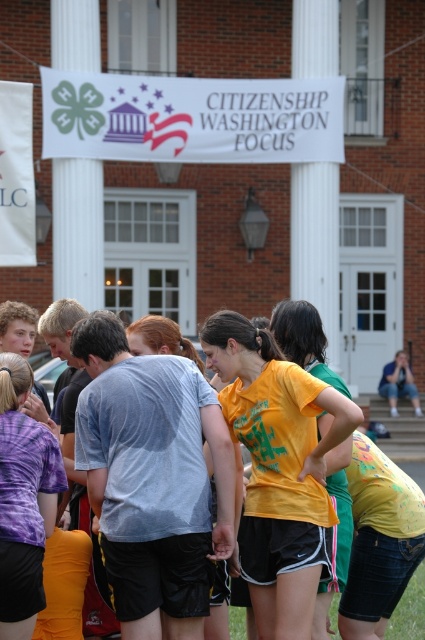
You are standing in front of the brick building with white columns and double doors. There are two points marked in the scene. The first point is at coordinates point (328, 307) and the second point is at point (79, 166). Which point is closer to you?

Point (328, 307) is further to the viewer than point (79, 166), so the closer point to you is point (79, 166).